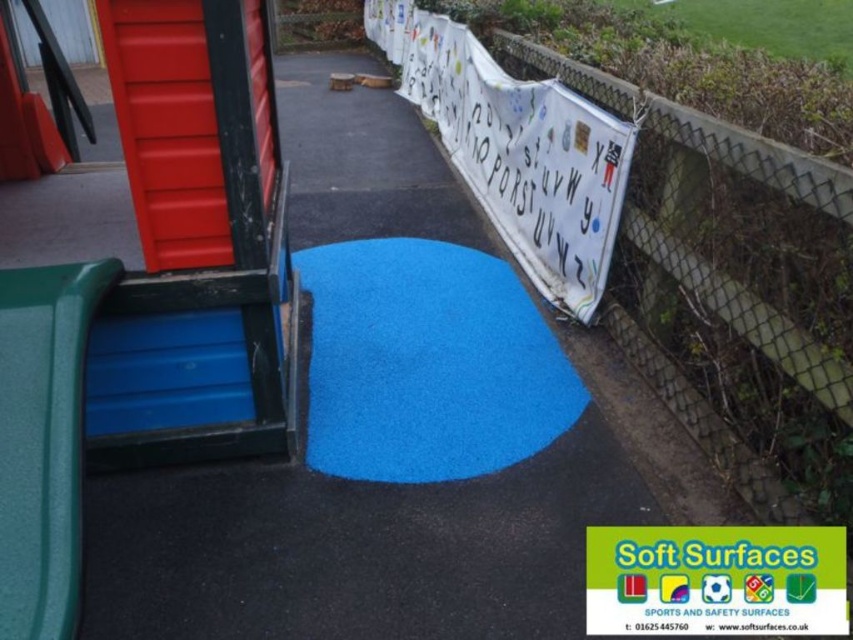
Is blue rubber mat at center smaller than green textured slide at left?

Actually, blue rubber mat at center might be larger than green textured slide at left.

Can you confirm if blue rubber mat at center is thinner than green textured slide at left?

Incorrect, blue rubber mat at center's width is not less than green textured slide at left's.

The image size is (853, 640). Describe the element at coordinates (427, 364) in the screenshot. I see `blue rubber mat at center` at that location.

Locate an element on the screen. blue rubber mat at center is located at coordinates (427, 364).